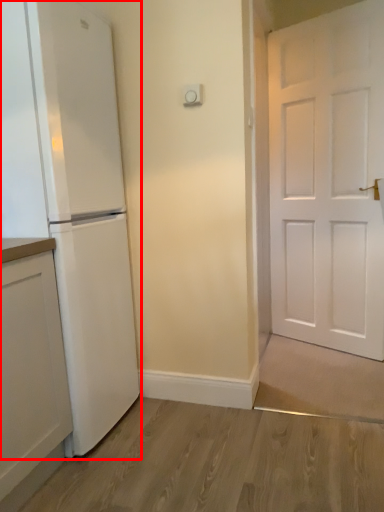
Question: From the image's perspective, what is the correct spatial relationship of refrigerator (annotated by the red box) in relation to cabinetry?

Choices:
 (A) below
 (B) above

Answer: (B)